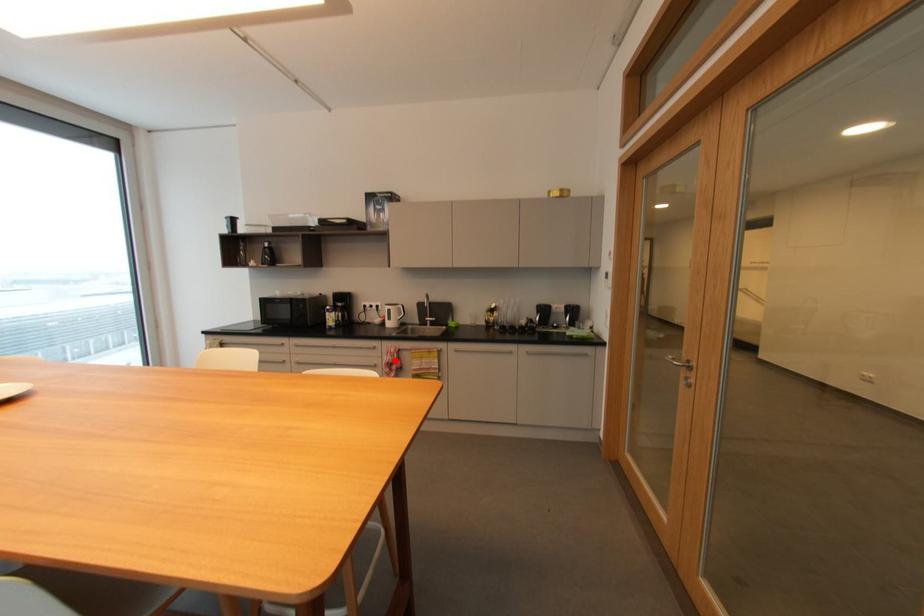
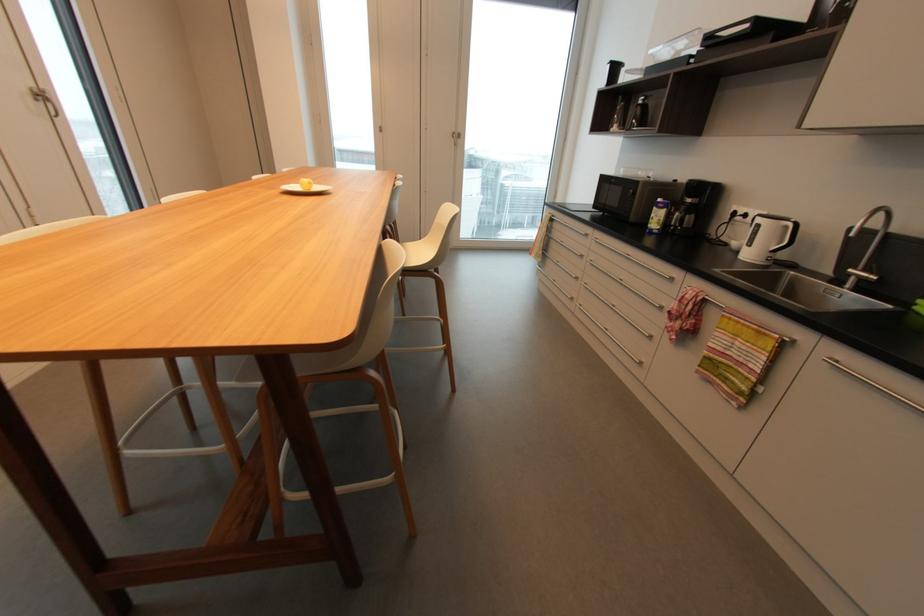
Where in the second image is the point corresponding to the highlighted location from the first image?

(681, 310)